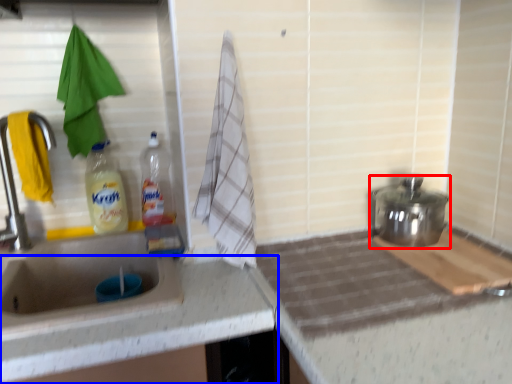
Question: Which object appears farthest to the camera in this image, appliance (highlighted by a red box) or countertop (highlighted by a blue box)?

Choices:
 (A) appliance
 (B) countertop

Answer: (A)